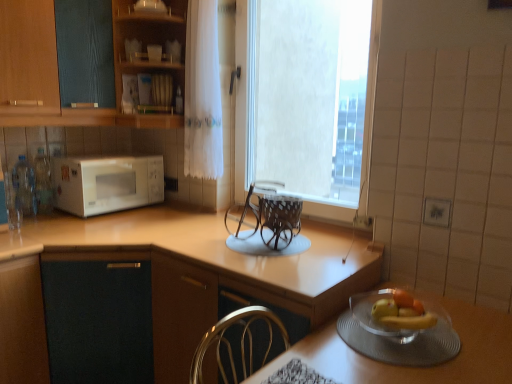
Question: Considering the relative positions of clear plastic bottles at left, the first bottle in the left-to-right sequence, and brown woven basket at center in the image provided, is clear plastic bottles at left, the first bottle in the left-to-right sequence, to the left or to the right of brown woven basket at center?

Choices:
 (A) right
 (B) left

Answer: (B)

Question: Is clear plastic bottles at left, the first bottle in the left-to-right sequence, wider or thinner than brown woven basket at center?

Choices:
 (A) thin
 (B) wide

Answer: (A)

Question: Estimate the real-world distances between objects in this image. Which object is farther from the clear glass bottle at left, which is the 1th bottle in right-to-left order?

Choices:
 (A) wooden shelves at upper center, the second cabinetry from the left
 (B) white sheer curtain at center
 (C) white textured window at center
 (D) brown woven basket at center
 (E) wooden cabinet at upper left, the second cabinetry when ordered from right to left

Answer: (C)

Question: Which object is positioned closest to the white matte microwave at left?

Choices:
 (A) wooden shelves at upper center, arranged as the first cabinetry when viewed from the right
 (B) clear plastic bottles at left, which is counted as the second bottle, starting from the right
 (C) brown woven basket at center
 (D) clear glass bottle at left, which is the second bottle from left to right
 (E) clear glass bowl at lower right

Answer: (D)